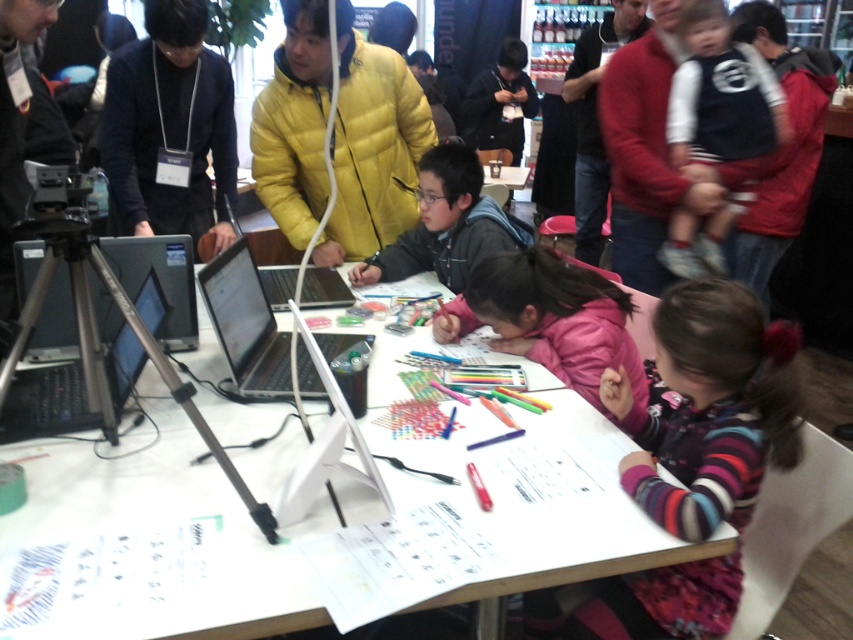
What do you see at coordinates (247, 323) in the screenshot? This screenshot has height=640, width=853. I see `silver/black laptop at center` at bounding box center [247, 323].

Who is shorter, silver/black laptop at center or dark blue jacket at center?

Standing shorter between the two is silver/black laptop at center.

Does point (207, 301) come in front of point (500, 88)?

Yes, point (207, 301) is in front of point (500, 88).

Locate an element on the screen. This screenshot has width=853, height=640. silver/black laptop at center is located at coordinates (247, 323).

Measure the distance between point (277,113) and camera.

A distance of 2.32 meters exists between point (277,113) and camera.

Which of these two, yellow puffy jacket at center or pink fleece jacket at center, stands shorter?

pink fleece jacket at center is shorter.

Which is in front, point (270, 179) or point (529, 288)?

Point (529, 288)

Where is `yellow puffy jacket at center`? The width and height of the screenshot is (853, 640). yellow puffy jacket at center is located at coordinates (372, 147).

Who is taller, yellow puffy jacket at center or silver metallic laptop at center?

Standing taller between the two is yellow puffy jacket at center.

Between yellow puffy jacket at center and silver metallic laptop at center, which one is positioned higher?

yellow puffy jacket at center is higher up.

Who is more forward, (285, 125) or (329, 284)?

Point (285, 125)

In order to click on yellow puffy jacket at center in this screenshot , I will do `click(372, 147)`.